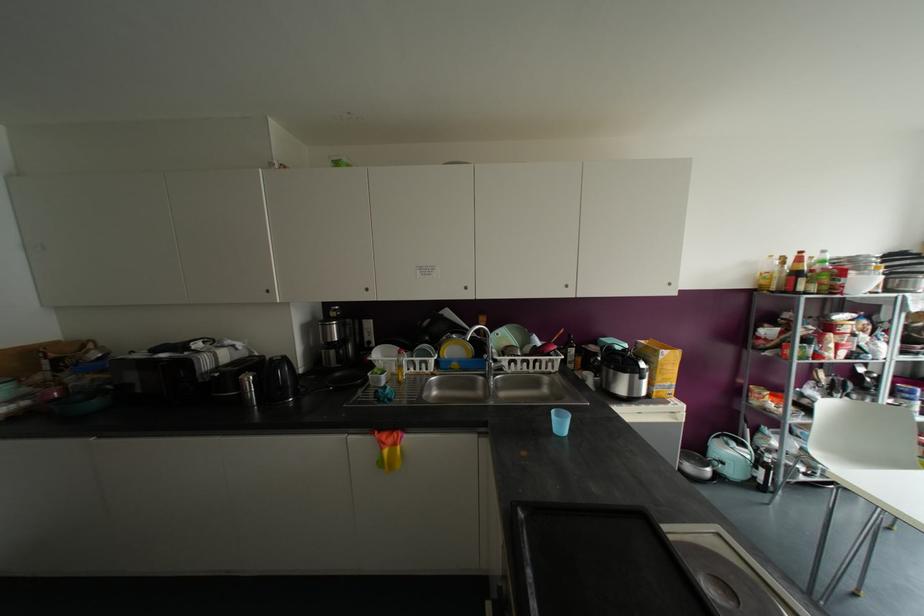
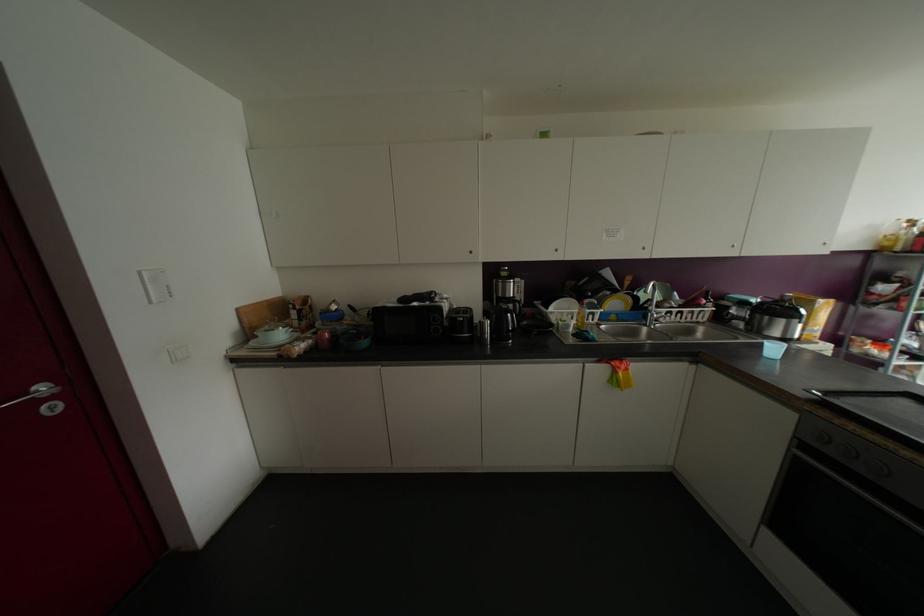
In the second image, find the point that corresponds to pixel 266 291 in the first image.

(469, 252)